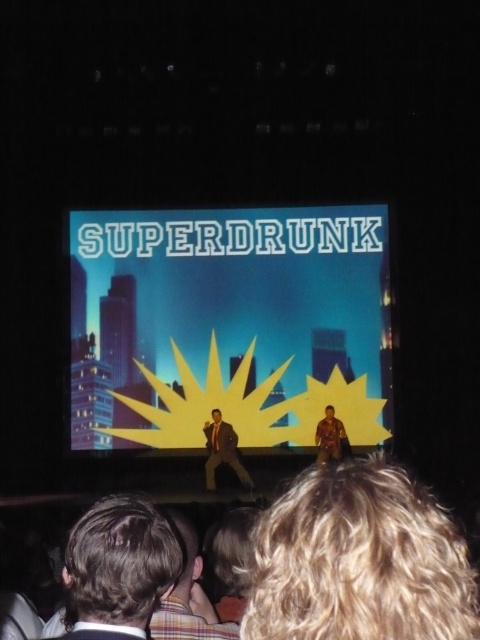
You are a stagehand who needs to place a prop on the stage. The prop must be placed exactly where the matte black suit at center is currently standing. What are the coordinates where you should place the prop?

The coordinates for placing the prop are point [222,449], as that is where the matte black suit at center is located.

You are an actor on stage and need to place a prop exactly at the center of the stage. The stage has a yellow paper at center. Where should you place the prop?

The yellow paper at center is already placed at the center coordinates point (228, 324), so you should place the prop there.